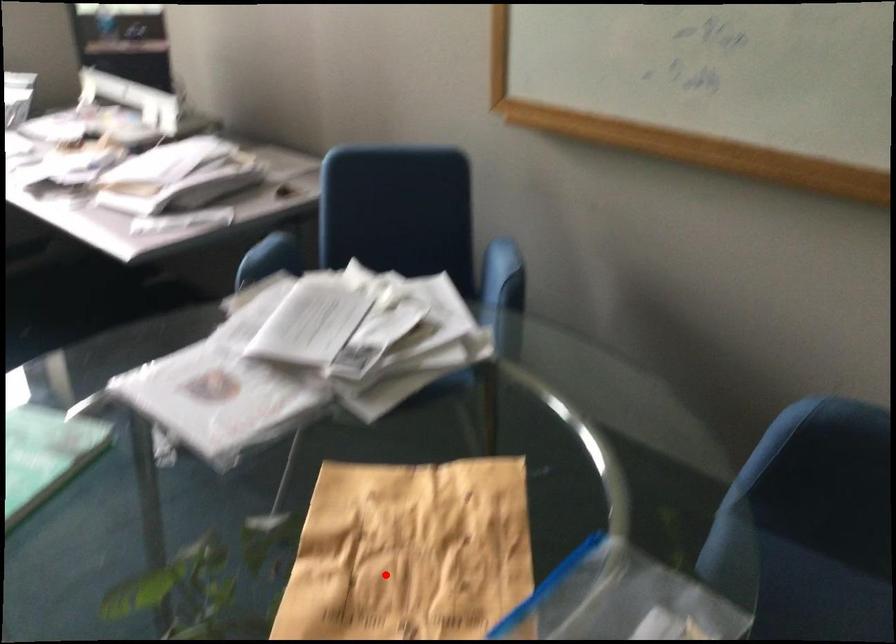
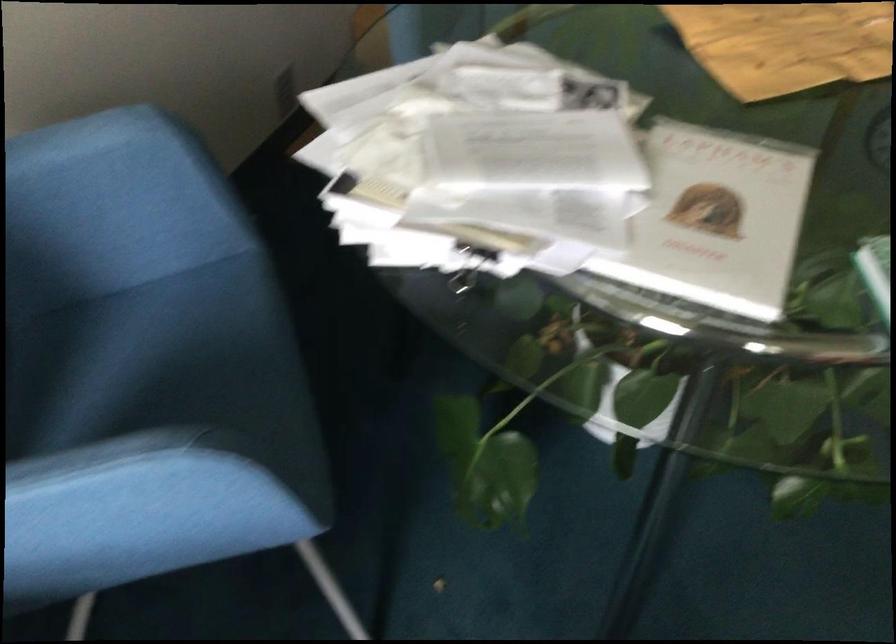
Locate, in the second image, the point that corresponds to the highlighted location in the first image.

(786, 44)